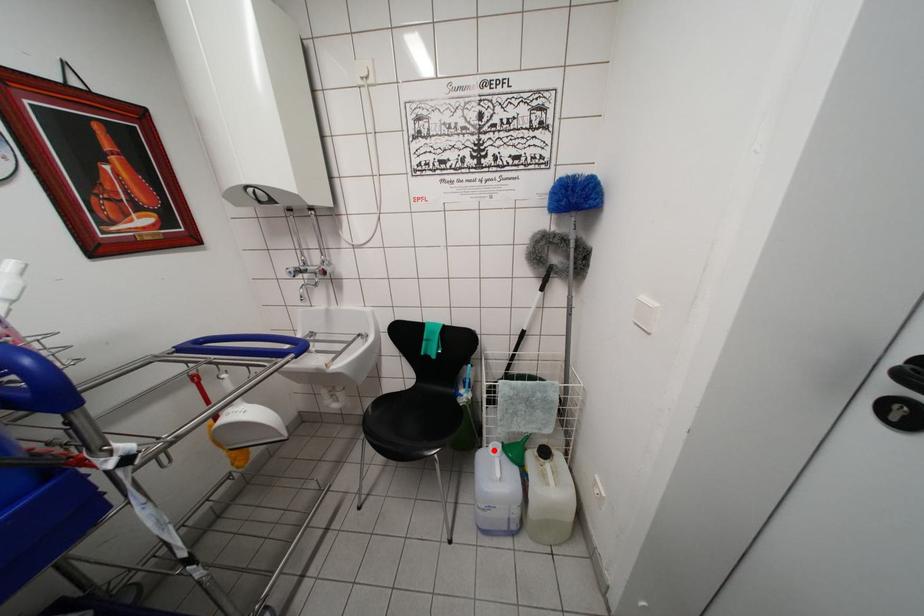
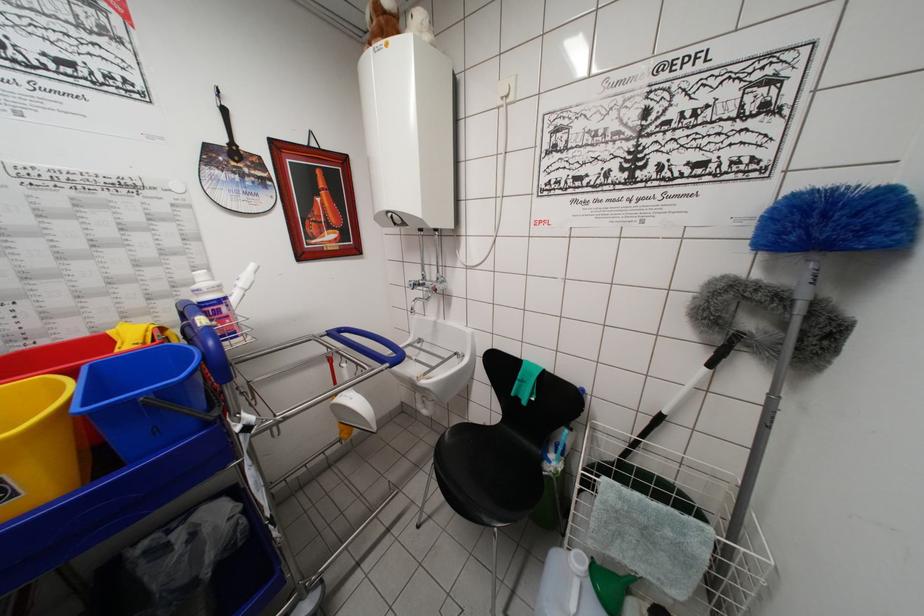
Question: I am providing you with two images of the same scene from different viewpoints. Image1 has a red point marked. In image2, the corresponding 3D location appears at what relative position? Reply with the corresponding letter.

Choices:
 (A) Closer
 (B) Farther

Answer: (A)